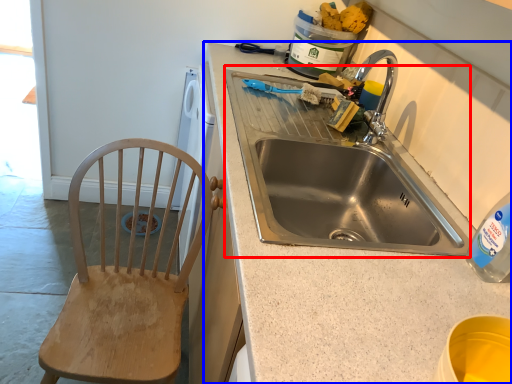
Question: Which object is further to the camera taking this photo, sink (highlighted by a red box) or countertop (highlighted by a blue box)?

Choices:
 (A) sink
 (B) countertop

Answer: (A)